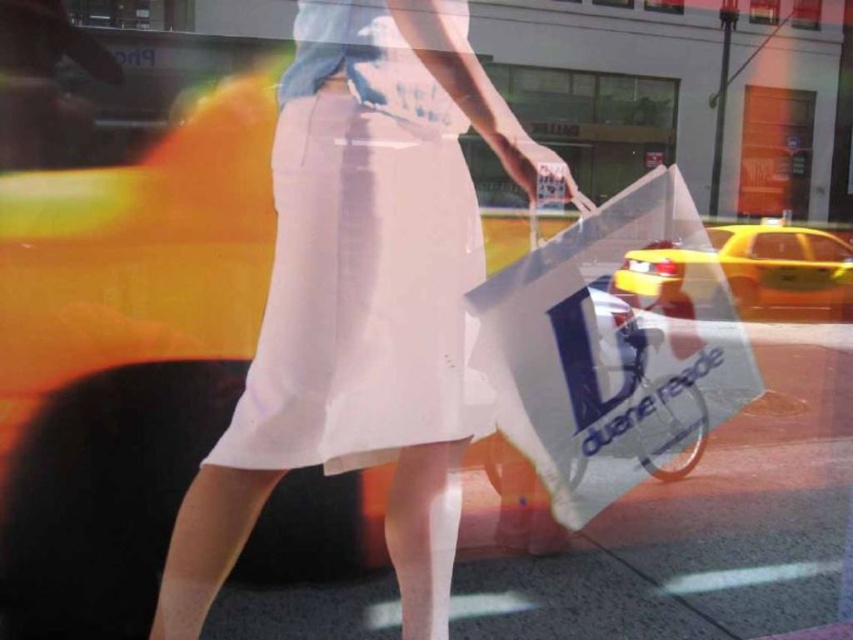
Question: Which of the following is the farthest from the observer?

Choices:
 (A) (746, 417)
 (B) (627, 262)
 (C) (193, 588)
 (D) (648, 134)

Answer: (A)

Question: In this image, where is white smooth pavement at center located relative to yellow matte taxi at right?

Choices:
 (A) above
 (B) below

Answer: (B)

Question: Can you confirm if matte white skirt at center is positioned below yellow matte taxi at right?

Choices:
 (A) no
 (B) yes

Answer: (B)

Question: Which point appears farthest from the camera in this image?

Choices:
 (A) coord(839,291)
 (B) coord(447,108)
 (C) coord(718,612)
 (D) coord(585,116)

Answer: (A)

Question: Considering the real-world distances, which object is farthest from the matte white skirt at center?

Choices:
 (A) white smooth pavement at center
 (B) yellow matte taxi at right
 (C) transparent plastic bag at center

Answer: (B)

Question: Is matte white skirt at center bigger than transparent plastic bag at center?

Choices:
 (A) no
 (B) yes

Answer: (B)